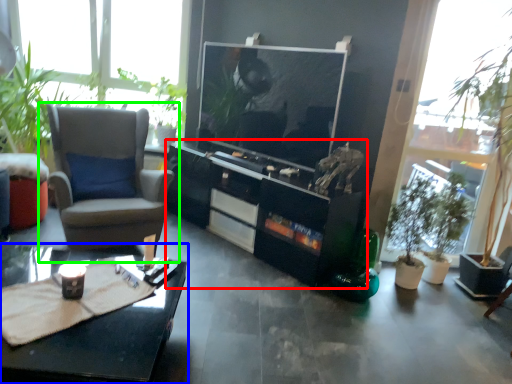
Question: Based on their relative distances, which object is nearer to cabinetry (highlighted by a red box)? Choose from coffee table (highlighted by a blue box) and chair (highlighted by a green box).

Choices:
 (A) coffee table
 (B) chair

Answer: (B)